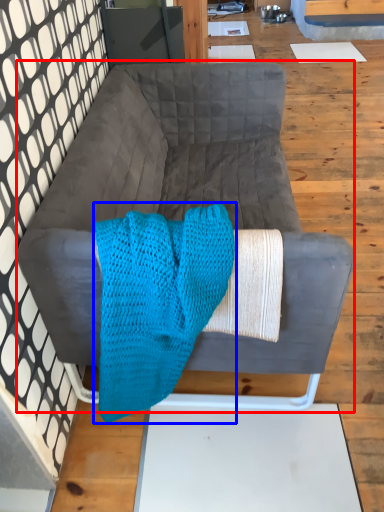
Question: Which of the following is the closest to the observer, studio couch (highlighted by a red box) or blanket (highlighted by a blue box)?

Choices:
 (A) studio couch
 (B) blanket

Answer: (B)